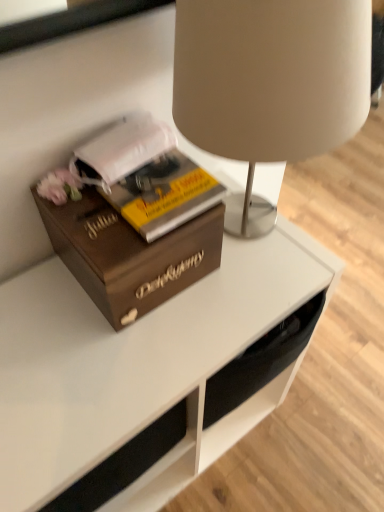
Locate an element on the screen. This screenshot has width=384, height=512. free space on the front side of wooden box at left is located at coordinates (112, 360).